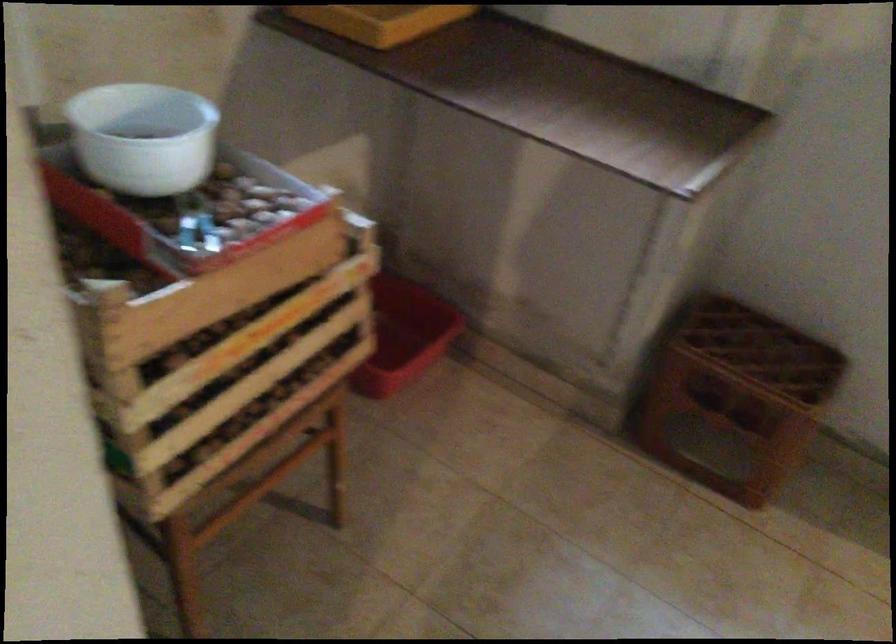
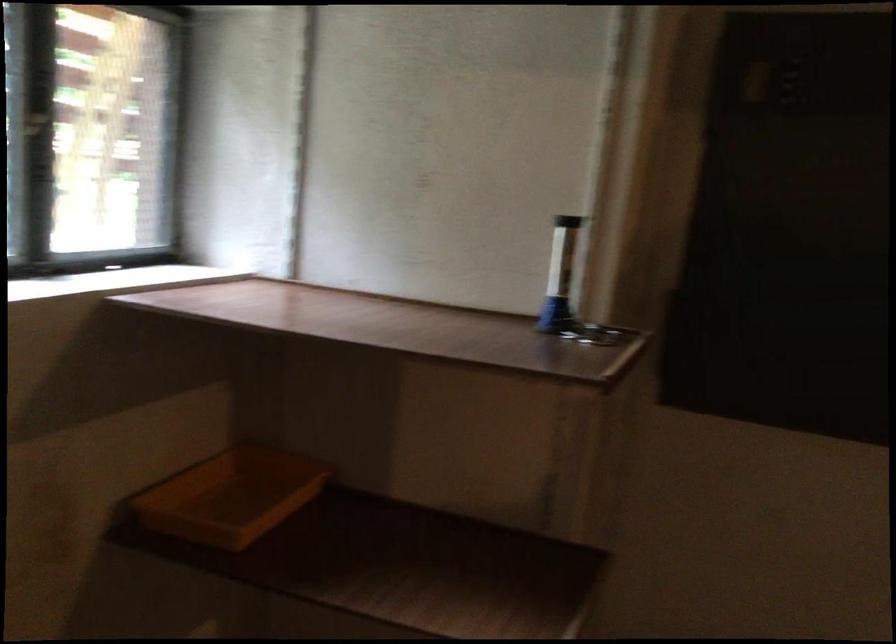
Question: The first image is from the beginning of the video and the second image is from the end. How did the camera likely rotate when shooting the video?

Choices:
 (A) Left
 (B) Right
 (C) Up
 (D) Down

Answer: (C)